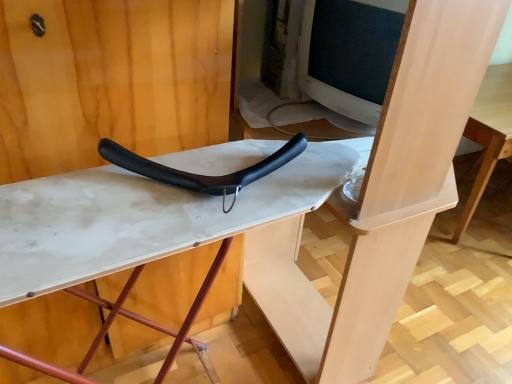
Question: Could you tell me if white matte ironing board at center is facing black matte handle at center?

Choices:
 (A) yes
 (B) no

Answer: (B)

Question: From a real-world perspective, is white matte ironing board at center positioned under black matte handle at center based on gravity?

Choices:
 (A) yes
 (B) no

Answer: (A)

Question: Is white matte ironing board at center smaller than black matte handle at center?

Choices:
 (A) no
 (B) yes

Answer: (A)

Question: Is black matte handle at center a part of white matte ironing board at center?

Choices:
 (A) yes
 (B) no

Answer: (B)

Question: Is the position of white matte ironing board at center less distant than that of black matte handle at center?

Choices:
 (A) no
 (B) yes

Answer: (B)

Question: Is white matte ironing board at center bigger than black matte handle at center?

Choices:
 (A) no
 (B) yes

Answer: (B)

Question: Does black matte handle at center have a smaller size compared to white matte ironing board at center?

Choices:
 (A) yes
 (B) no

Answer: (A)

Question: Considering the relative positions of black matte handle at center and white matte ironing board at center in the image provided, is black matte handle at center to the right of white matte ironing board at center from the viewer's perspective?

Choices:
 (A) no
 (B) yes

Answer: (B)

Question: Considering the relative sizes of black matte handle at center and white matte ironing board at center in the image provided, is black matte handle at center bigger than white matte ironing board at center?

Choices:
 (A) no
 (B) yes

Answer: (A)

Question: Does black matte handle at center have a lesser height compared to white matte ironing board at center?

Choices:
 (A) no
 (B) yes

Answer: (B)

Question: Could white matte ironing board at center be considered to be inside black matte handle at center?

Choices:
 (A) yes
 (B) no

Answer: (B)

Question: Would you say black matte handle at center is outside white matte ironing board at center?

Choices:
 (A) no
 (B) yes

Answer: (B)

Question: Considering the positions of point (148, 170) and point (132, 230), is point (148, 170) closer or farther from the camera than point (132, 230)?

Choices:
 (A) closer
 (B) farther

Answer: (B)